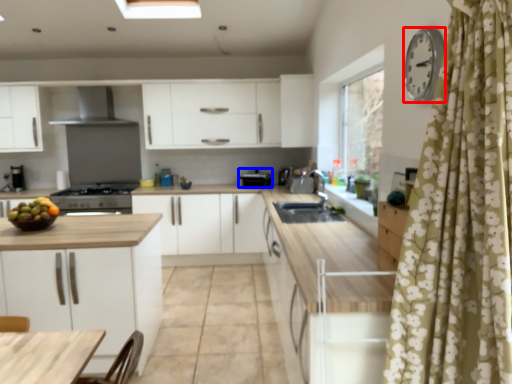
Question: Which object appears closest to the camera in this image, clock (highlighted by a red box) or appliance (highlighted by a blue box)?

Choices:
 (A) clock
 (B) appliance

Answer: (A)